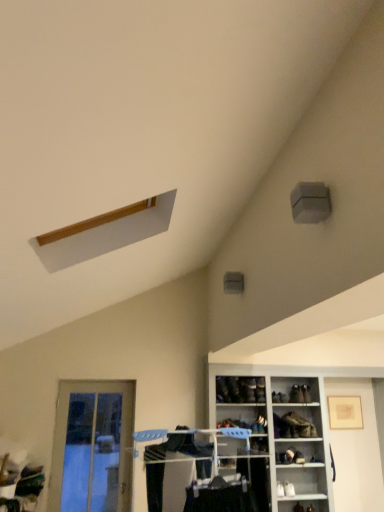
Question: Is white glossy shoe rack at lower right, the second shelf positioned from the left, to the left or to the right of matte black shoe at lower center, positioned as the 1th shelf in left-to-right order, in the image?

Choices:
 (A) right
 (B) left

Answer: (A)

Question: Relative to matte black shoe at lower center, arranged as the second shelf when viewed from the right, is white glossy shoe rack at lower right, the 1th shelf when ordered from right to left, in front or behind?

Choices:
 (A) front
 (B) behind

Answer: (A)

Question: Estimate the real-world distances between objects in this image. Which object is farther from the leather shoe at lower center, which is the 1th shoe from right to left?

Choices:
 (A) leather shoe at center, acting as the second shoe starting from the right
 (B) leather shoe at center, the 3th shoe from the right
 (C) clear glass door at lower left
 (D) matte plastic clothes rack at lower center
 (E) matte black shoe at lower center, arranged as the second shelf when viewed from the right

Answer: (D)

Question: Which of these objects is positioned closest to the dark brown leather shoe at lower center, the 4th shoe from the right?

Choices:
 (A) clear glass door at lower left
 (B) leather shoe at center, the 3th shoe from the right
 (C) matte black shoe at lower center, arranged as the second shelf when viewed from the right
 (D) white glossy shoe rack at lower right, the second shelf positioned from the left
 (E) leather shoe at center, which is counted as the 3th shoe, starting from the left

Answer: (B)